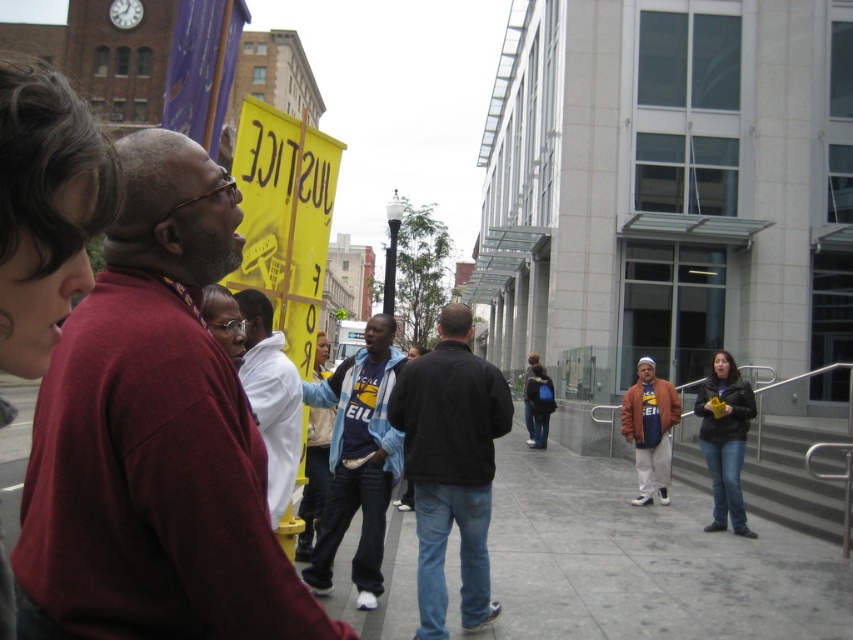
Question: Which object is farther from the camera taking this photo?

Choices:
 (A) white fleece jacket at center
 (B) denim jacket at center

Answer: (B)

Question: Does dark blue jeans at center come behind denim jacket at center?

Choices:
 (A) no
 (B) yes

Answer: (A)

Question: Which object appears farthest from the camera in this image?

Choices:
 (A) white fleece jacket at center
 (B) denim jacket at lower right
 (C) maroon sweater at left
 (D) dark blue jeans at center

Answer: (B)

Question: Which object appears closest to the camera in this image?

Choices:
 (A) blue fabric backpack at center
 (B) smooth concrete sidewalk at center
 (C) orange cotton jacket at center

Answer: (B)

Question: Is denim jacket at lower right bigger than blue denim jeans at center?

Choices:
 (A) yes
 (B) no

Answer: (A)

Question: Does maroon sweater at left appear on the right side of dark blue jeans at center?

Choices:
 (A) no
 (B) yes

Answer: (A)